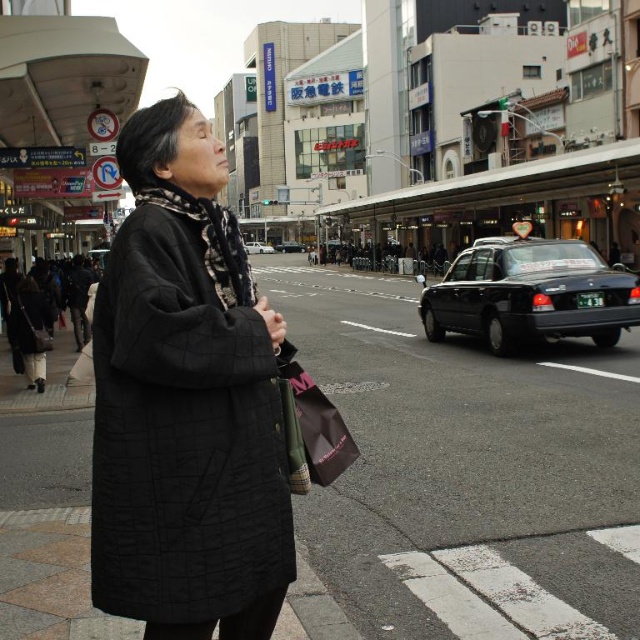
Can you confirm if black quilted coat at center is positioned above white matte taxi at center?

No, black quilted coat at center is not above white matte taxi at center.

Which is behind, point (35, 364) or point (252, 246)?

The point (252, 246) is behind.

Between point (45, 316) and point (259, 243), which one is positioned in front?

Point (45, 316)

Locate an element on the screen. This screenshot has width=640, height=640. black quilted coat at center is located at coordinates (29, 330).

Which is behind, point (252, 246) or point (285, 246)?

The point (285, 246) is more distant.

Find the location of a particular element. The image size is (640, 640). white matte taxi at center is located at coordinates (257, 248).

How much distance is there between matte black coat at center and black matte taxi at center?

matte black coat at center is 109.20 meters from black matte taxi at center.

Between point (196, 636) and point (278, 246), which one is positioned behind?

The point (278, 246) is more distant.

Locate an element on the screen. The image size is (640, 640). matte black coat at center is located at coordinates (186, 403).